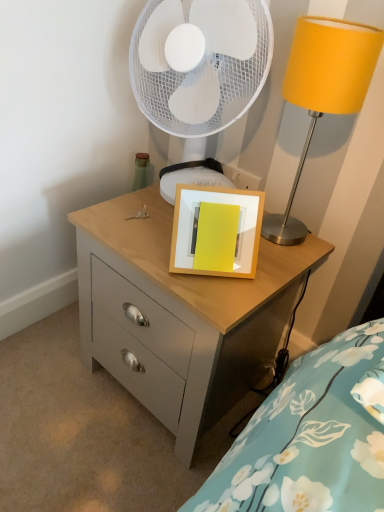
Question: Is matte wood chest of drawers at center touching white mesh mechanical fan at upper center?

Choices:
 (A) yes
 (B) no

Answer: (B)

Question: Is matte wood chest of drawers at center aimed at white mesh mechanical fan at upper center?

Choices:
 (A) no
 (B) yes

Answer: (A)

Question: Is the position of matte wood chest of drawers at center less distant than that of white mesh mechanical fan at upper center?

Choices:
 (A) yes
 (B) no

Answer: (A)

Question: Is matte wood chest of drawers at center far from white mesh mechanical fan at upper center?

Choices:
 (A) no
 (B) yes

Answer: (A)

Question: Is matte wood chest of drawers at center shorter than white mesh mechanical fan at upper center?

Choices:
 (A) yes
 (B) no

Answer: (B)

Question: Is matte wood chest of drawers at center positioned behind white mesh mechanical fan at upper center?

Choices:
 (A) no
 (B) yes

Answer: (A)

Question: Does matte wood chest of drawers at center have a greater height compared to metallic yellow lampshade at upper right?

Choices:
 (A) no
 (B) yes

Answer: (B)

Question: From a real-world perspective, is matte wood chest of drawers at center physically below metallic yellow lampshade at upper right?

Choices:
 (A) yes
 (B) no

Answer: (A)

Question: Is matte wood chest of drawers at center beside metallic yellow lampshade at upper right?

Choices:
 (A) yes
 (B) no

Answer: (B)

Question: Would you say matte wood chest of drawers at center is outside metallic yellow lampshade at upper right?

Choices:
 (A) yes
 (B) no

Answer: (A)

Question: From a real-world perspective, is matte wood chest of drawers at center on metallic yellow lampshade at upper right?

Choices:
 (A) no
 (B) yes

Answer: (A)

Question: From the image's perspective, would you say matte wood chest of drawers at center is shown under metallic yellow lampshade at upper right?

Choices:
 (A) no
 (B) yes

Answer: (B)

Question: Is white mesh mechanical fan at upper center further to the viewer compared to wooden picture frame at center?

Choices:
 (A) yes
 (B) no

Answer: (A)